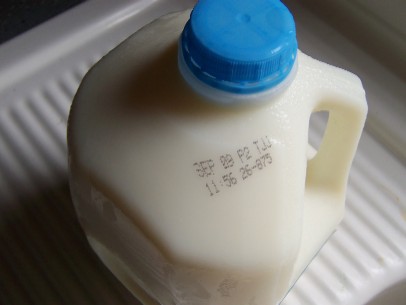
What are the coordinates of `white shelf` in the screenshot? It's located at (49, 114).